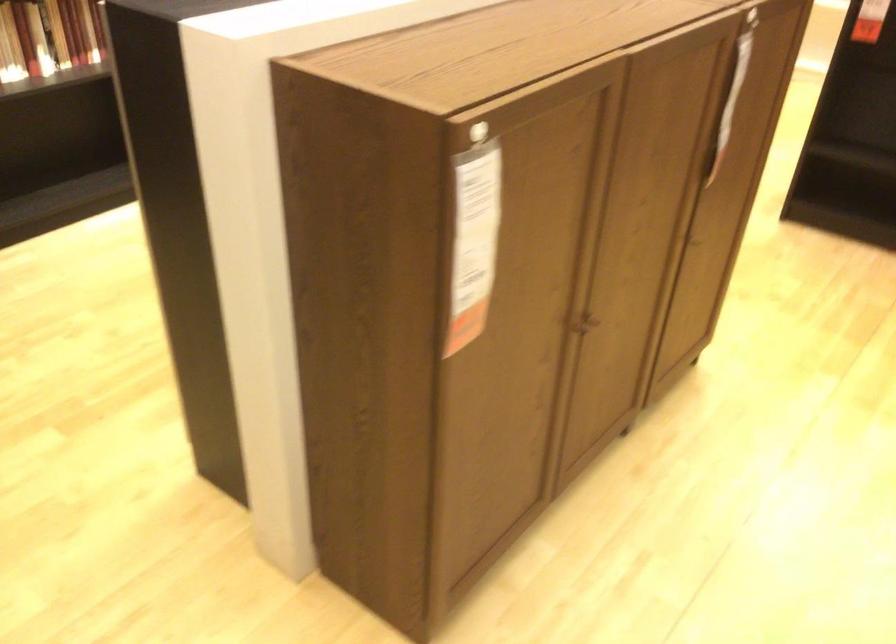
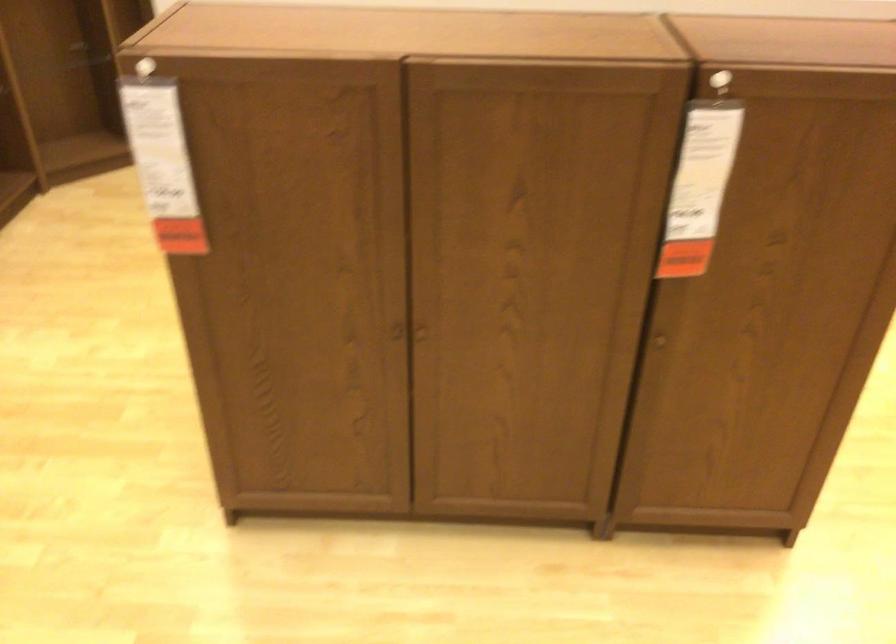
Locate, in the second image, the point that corresponds to the point at 701,234 in the first image.

(659, 341)